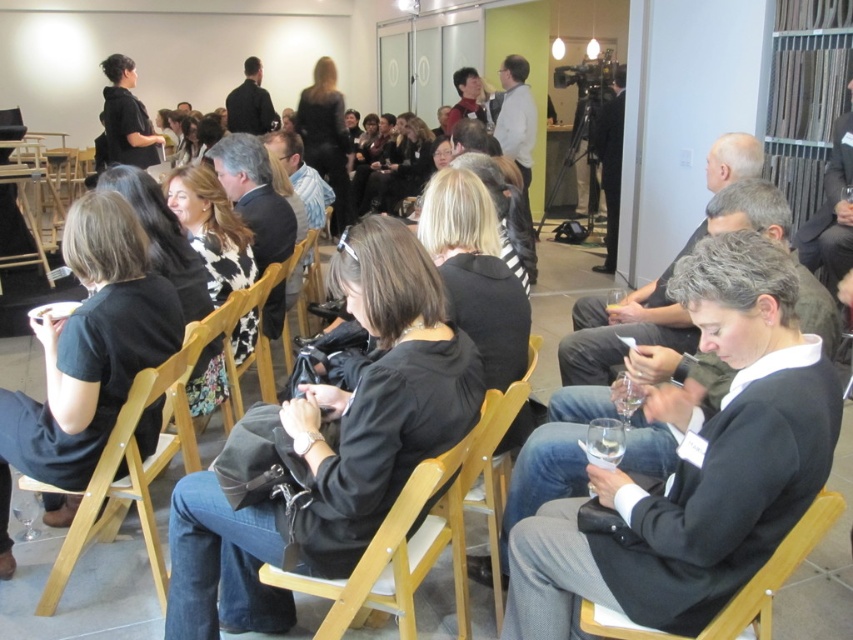
Is black matte jacket at center further to the viewer compared to black leather chair at center?

Yes, black matte jacket at center is behind black leather chair at center.

Based on the photo, can you confirm if black matte jacket at center is positioned above black leather chair at center?

Correct, black matte jacket at center is located above black leather chair at center.

Is point (337, 477) closer to camera compared to point (831, 493)?

No, it is not.

Where is `black matte jacket at center`? The height and width of the screenshot is (640, 853). black matte jacket at center is located at coordinates (380, 396).

Is black matte jacket at center taller than wooden chair at left?

Indeed, black matte jacket at center has a greater height compared to wooden chair at left.

Does black matte jacket at center have a greater width compared to wooden chair at left?

Correct, the width of black matte jacket at center exceeds that of wooden chair at left.

You are a GUI agent. You are given a task and a screenshot of the screen. Output one action in this format:
    pyautogui.click(x=<x>, y=<y>)
    Task: Click on the black matte jacket at center
    
    Given the screenshot: What is the action you would take?
    pyautogui.click(x=380, y=396)

Describe the element at coordinates (132, 472) in the screenshot. This screenshot has width=853, height=640. I see `wooden chair at left` at that location.

Between point (125, 422) and point (709, 637), which one is positioned in front?

Point (709, 637) is in front.

Describe the element at coordinates (132, 472) in the screenshot. I see `wooden chair at left` at that location.

Find the location of a particular element. This screenshot has width=853, height=640. wooden chair at left is located at coordinates (132, 472).